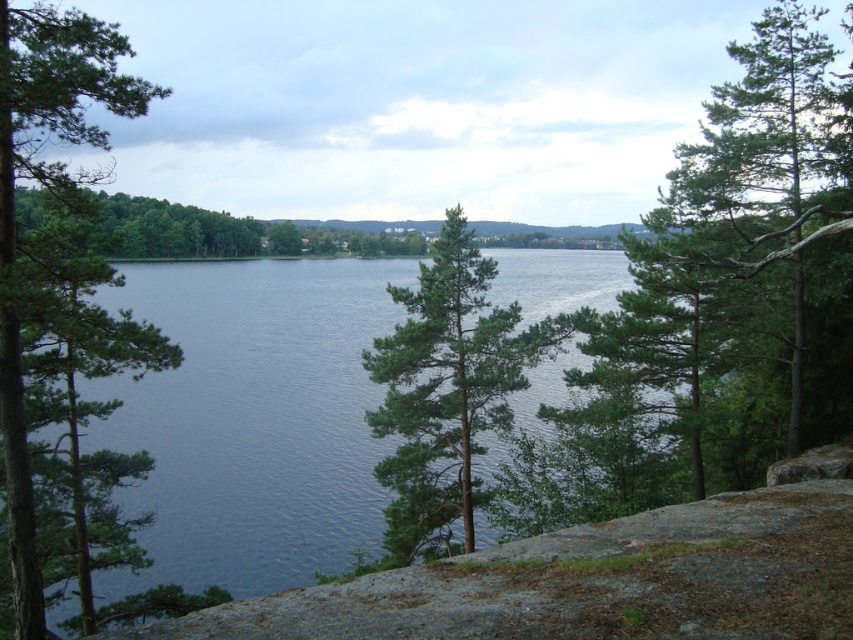
Question: Does green needle-like tree at center appear on the right side of green matte tree at left?

Choices:
 (A) no
 (B) yes

Answer: (B)

Question: Is blue water at center further to camera compared to green needle-like tree at center?

Choices:
 (A) no
 (B) yes

Answer: (B)

Question: Which point is farther from the camera taking this photo?

Choices:
 (A) (780, 426)
 (B) (3, 81)
 (C) (421, 344)

Answer: (A)

Question: Which object is farther from the camera taking this photo?

Choices:
 (A) blue water at center
 (B) green matte tree at left
 (C) green needle-like tree at center

Answer: (A)

Question: Does green textured tree at right have a smaller size compared to green needle-like tree at center?

Choices:
 (A) no
 (B) yes

Answer: (A)

Question: Which of the following is the farthest from the observer?

Choices:
 (A) green matte tree at left
 (B) green textured tree at right
 (C) blue water at center

Answer: (C)